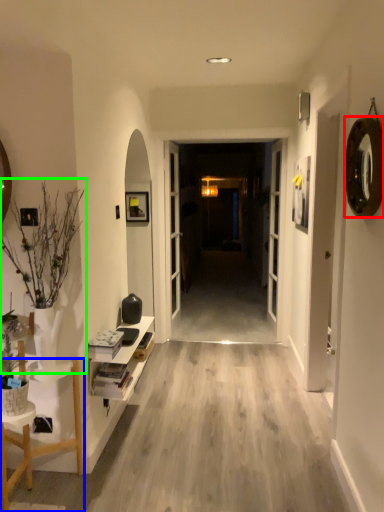
Question: Which object is the closest to the oval (highlighted by a red box)? Choose among these: furniture (highlighted by a blue box) or houseplant (highlighted by a green box).

Choices:
 (A) furniture
 (B) houseplant

Answer: (B)